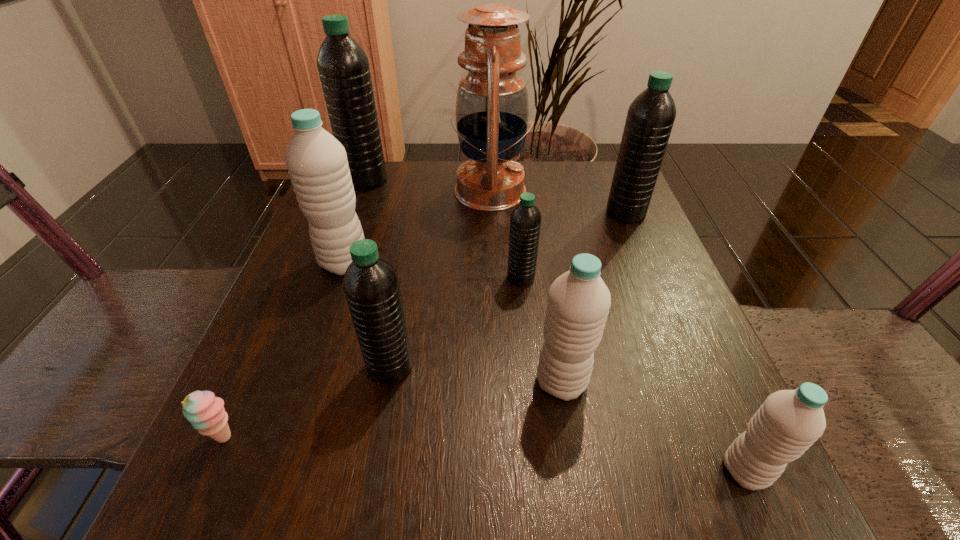
This screenshot has width=960, height=540. Identify the location of vacant area situated on the front of the fifth water bottle from right to left. (377, 437).

The image size is (960, 540). I want to click on free space located on the front of the second smallest white water bottle, so click(575, 467).

The height and width of the screenshot is (540, 960). What are the coordinates of `vacant space located 0.220m on the right of the third black water bottle from left to right` in the screenshot? It's located at (651, 277).

This screenshot has width=960, height=540. Identify the location of vacant space located on the left of the nearest water bottle. (645, 470).

Locate an element on the screen. This screenshot has width=960, height=540. free region located 0.280m on the back of the sherbert is located at coordinates (294, 285).

The image size is (960, 540). In order to click on oil lamp that is at the far edge in this screenshot , I will do `click(492, 107)`.

Image resolution: width=960 pixels, height=540 pixels. I want to click on object located at the near edge, so click(x=789, y=421).

Identify the location of sherbert present at the left edge. This screenshot has height=540, width=960. (206, 413).

Find the location of `object that is at the far left corner`. object that is at the far left corner is located at coordinates (343, 66).

Where is `object that is at the far right corner`? This screenshot has width=960, height=540. object that is at the far right corner is located at coordinates (650, 117).